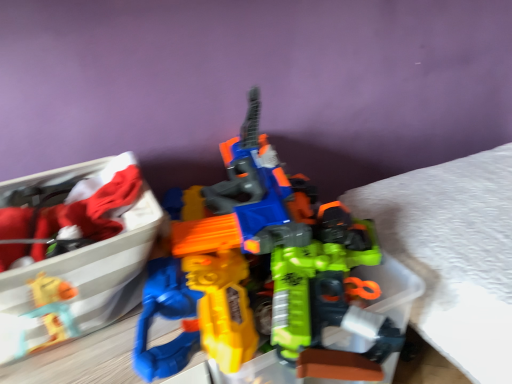
What is the approximate height of matte plastic toy gun at left?

matte plastic toy gun at left is 8.27 inches tall.

Locate an element on the screen. The height and width of the screenshot is (384, 512). matte plastic toy gun at left is located at coordinates (74, 255).

The image size is (512, 384). What do you see at coordinates (74, 255) in the screenshot? I see `matte plastic toy gun at left` at bounding box center [74, 255].

From the picture: Measure the distance between point (7, 338) and camera.

The distance of point (7, 338) from camera is 24.61 inches.

Describe the element at coordinates (262, 271) in the screenshot. I see `matte plastic toy gun at center` at that location.

Locate an element on the screen. The width and height of the screenshot is (512, 384). matte plastic toy gun at center is located at coordinates (262, 271).

Find the location of a particular element. This screenshot has height=384, width=512. matte plastic toy gun at left is located at coordinates (74, 255).

Is matte plastic toy gun at left to the left or to the right of matte plastic toy gun at center in the image?

In the image, matte plastic toy gun at left appears on the left side of matte plastic toy gun at center.

Considering the positions of objects matte plastic toy gun at left and matte plastic toy gun at center in the image provided, who is behind, matte plastic toy gun at left or matte plastic toy gun at center?

Positioned behind is matte plastic toy gun at left.

Does point (133, 188) lie behind point (193, 219)?

No, (133, 188) is in front of (193, 219).

In the scene shown: From the image's perspective, is matte plastic toy gun at left on top of matte plastic toy gun at center?

Actually, matte plastic toy gun at left appears below matte plastic toy gun at center in the image.

From a real-world perspective, is matte plastic toy gun at left located beneath matte plastic toy gun at center?

Indeed, from a real-world perspective, matte plastic toy gun at left is positioned beneath matte plastic toy gun at center.

In terms of width, does matte plastic toy gun at left look wider or thinner when compared to matte plastic toy gun at center?

matte plastic toy gun at left is thinner than matte plastic toy gun at center.

Considering the relative sizes of matte plastic toy gun at left and matte plastic toy gun at center in the image provided, is matte plastic toy gun at left taller than matte plastic toy gun at center?

No, matte plastic toy gun at left is not taller than matte plastic toy gun at center.

Between matte plastic toy gun at left and matte plastic toy gun at center, which one has smaller size?

matte plastic toy gun at left is smaller.

Is matte plastic toy gun at left located outside matte plastic toy gun at center?

No, most part of matte plastic toy gun at left lies within matte plastic toy gun at center.

Would you say matte plastic toy gun at left is a long distance from matte plastic toy gun at center?

No, matte plastic toy gun at left is in close proximity to matte plastic toy gun at center.

From the picture: Is matte plastic toy gun at left facing towards matte plastic toy gun at center?

No, matte plastic toy gun at left does not turn towards matte plastic toy gun at center.

Image resolution: width=512 pixels, height=384 pixels. I want to click on toy in front of the matte plastic toy gun at left, so click(262, 271).

Does matte plastic toy gun at center appear on the right side of matte plastic toy gun at left?

Correct, you'll find matte plastic toy gun at center to the right of matte plastic toy gun at left.

Which object is further away from the camera, matte plastic toy gun at center or matte plastic toy gun at left?

Positioned behind is matte plastic toy gun at left.

Does point (315, 220) lie in front of point (71, 272)?

No, (315, 220) is further to viewer.

From the image's perspective, which one is positioned higher, matte plastic toy gun at center or matte plastic toy gun at left?

matte plastic toy gun at center.

Looking at this image, from a real-world perspective, is matte plastic toy gun at center positioned over matte plastic toy gun at left based on gravity?

Yes, from a real-world perspective, matte plastic toy gun at center is above matte plastic toy gun at left.

Considering the relative sizes of matte plastic toy gun at center and matte plastic toy gun at left in the image provided, is matte plastic toy gun at center thinner than matte plastic toy gun at left?

No, matte plastic toy gun at center is not thinner than matte plastic toy gun at left.

Considering the relative sizes of matte plastic toy gun at center and matte plastic toy gun at left in the image provided, is matte plastic toy gun at center shorter than matte plastic toy gun at left?

In fact, matte plastic toy gun at center may be taller than matte plastic toy gun at left.

Considering the sizes of matte plastic toy gun at center and matte plastic toy gun at left in the image, is matte plastic toy gun at center bigger or smaller than matte plastic toy gun at left?

Considering their sizes, matte plastic toy gun at center takes up more space than matte plastic toy gun at left.

Choose the correct answer: Is matte plastic toy gun at center inside matte plastic toy gun at left or outside it?

matte plastic toy gun at center lies outside matte plastic toy gun at left.

Is the surface of matte plastic toy gun at center in direct contact with matte plastic toy gun at left?

There is a gap between matte plastic toy gun at center and matte plastic toy gun at left.

Could you tell me if matte plastic toy gun at center is turned towards matte plastic toy gun at left?

No, matte plastic toy gun at center is not oriented towards matte plastic toy gun at left.

How much distance is there between matte plastic toy gun at center and matte plastic toy gun at left?

The distance of matte plastic toy gun at center from matte plastic toy gun at left is 7.61 inches.

Where is `toy in front of the matte plastic toy gun at left`? This screenshot has width=512, height=384. toy in front of the matte plastic toy gun at left is located at coordinates pos(262,271).

This screenshot has width=512, height=384. In order to click on toy that is in front of the matte plastic toy gun at left in this screenshot , I will do `click(262, 271)`.

The width and height of the screenshot is (512, 384). I want to click on wide below the matte plastic toy gun at center (from the image's perspective), so click(x=74, y=255).